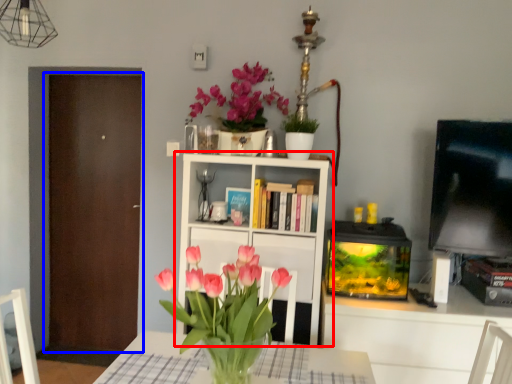
Question: Which object appears farthest to the camera in this image, bookcase (highlighted by a red box) or door (highlighted by a blue box)?

Choices:
 (A) bookcase
 (B) door

Answer: (B)